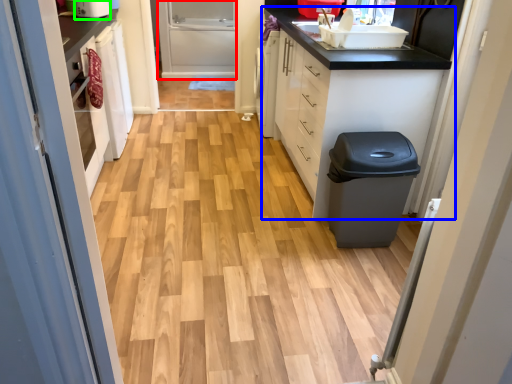
Question: Which object is the farthest from screen door (highlighted by a red box)? Choose among these: cabinetry (highlighted by a blue box) or appliance (highlighted by a green box).

Choices:
 (A) cabinetry
 (B) appliance

Answer: (B)